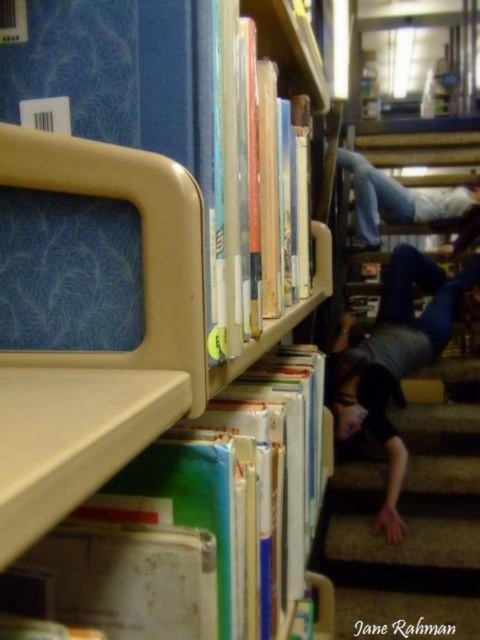
You are standing in the library and see two points marked in the scene. Which point, point (224, 616) or point (357, 556), is closer to you?

Point (224, 616) is closer to the camera than point (357, 556).